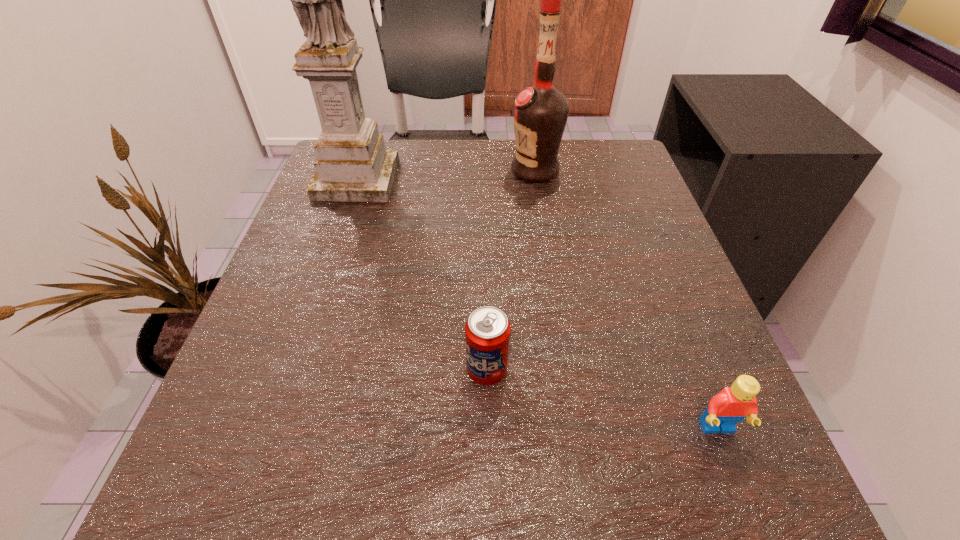
Where is `vacant region that satisfies the following two spatial constraints: 1. on the front and back of the liquor; 2. on the front-facing side of the tallest object`? This screenshot has height=540, width=960. vacant region that satisfies the following two spatial constraints: 1. on the front and back of the liquor; 2. on the front-facing side of the tallest object is located at coordinates (537, 179).

You are a GUI agent. You are given a task and a screenshot of the screen. Output one action in this format:
    pyautogui.click(x=<x>, y=<y>)
    Task: Click on the vacant position in the image that satisfies the following two spatial constraints: 1. on the front and back of the liquor; 2. on the front-facing side of the sculpture
    The width and height of the screenshot is (960, 540).
    Given the screenshot: What is the action you would take?
    pyautogui.click(x=537, y=179)